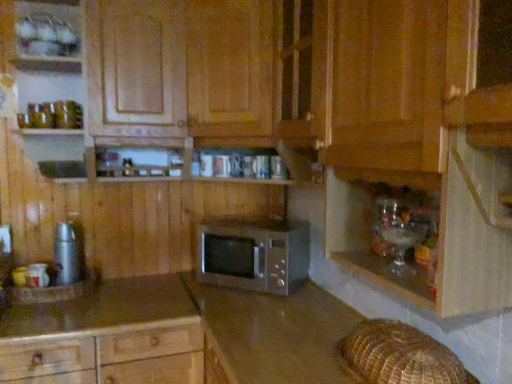
Question: From a real-world perspective, is translucent glassware at lower right under satin brown microwave at center, the first cabinetry positioned from the bottom?

Choices:
 (A) yes
 (B) no

Answer: (B)

Question: Considering the relative positions of translucent glassware at lower right and satin brown microwave at center, the first cabinetry positioned from the bottom, in the image provided, is translucent glassware at lower right behind satin brown microwave at center, the first cabinetry positioned from the bottom,?

Choices:
 (A) no
 (B) yes

Answer: (B)

Question: Is translucent glassware at lower right turned away from satin brown microwave at center, the first cabinetry positioned from the bottom?

Choices:
 (A) yes
 (B) no

Answer: (B)

Question: Is translucent glassware at lower right located outside satin brown microwave at center, the first cabinetry positioned from the bottom?

Choices:
 (A) no
 (B) yes

Answer: (B)

Question: Can you confirm if translucent glassware at lower right is smaller than satin brown microwave at center, acting as the second cabinetry starting from the top?

Choices:
 (A) no
 (B) yes

Answer: (B)

Question: Looking at their shapes, would you say wooden microwave at center, placed as the first cabinetry when sorted from top to bottom, is wider or thinner than satin silver microwave at center?

Choices:
 (A) thin
 (B) wide

Answer: (B)

Question: From the image's perspective, relative to satin silver microwave at center, is wooden microwave at center, marked as the 2th cabinetry in a bottom-to-top arrangement, above or below?

Choices:
 (A) below
 (B) above

Answer: (B)

Question: Relative to satin silver microwave at center, is wooden microwave at center, placed as the first cabinetry when sorted from top to bottom, in front or behind?

Choices:
 (A) behind
 (B) front

Answer: (B)

Question: Considering the positions of wooden microwave at center, placed as the first cabinetry when sorted from top to bottom, and satin silver microwave at center in the image, is wooden microwave at center, placed as the first cabinetry when sorted from top to bottom, taller or shorter than satin silver microwave at center?

Choices:
 (A) short
 (B) tall

Answer: (B)

Question: From the image's perspective, is satin brown microwave at center, the first cabinetry positioned from the bottom, above or below wooden microwave at center, marked as the 2th cabinetry in a bottom-to-top arrangement?

Choices:
 (A) above
 (B) below

Answer: (B)

Question: Relative to wooden microwave at center, placed as the first cabinetry when sorted from top to bottom, is satin brown microwave at center, the first cabinetry positioned from the bottom, in front or behind?

Choices:
 (A) behind
 (B) front

Answer: (A)

Question: In terms of width, does satin brown microwave at center, acting as the second cabinetry starting from the top, look wider or thinner when compared to wooden microwave at center, placed as the first cabinetry when sorted from top to bottom?

Choices:
 (A) thin
 (B) wide

Answer: (B)

Question: In terms of size, does satin brown microwave at center, acting as the second cabinetry starting from the top, appear bigger or smaller than wooden microwave at center, placed as the first cabinetry when sorted from top to bottom?

Choices:
 (A) big
 (B) small

Answer: (B)

Question: From a real-world perspective, is satin silver microwave at center above or below smooth brown countertop at lower left?

Choices:
 (A) below
 (B) above

Answer: (B)

Question: In terms of height, does satin silver microwave at center look taller or shorter compared to smooth brown countertop at lower left?

Choices:
 (A) tall
 (B) short

Answer: (B)